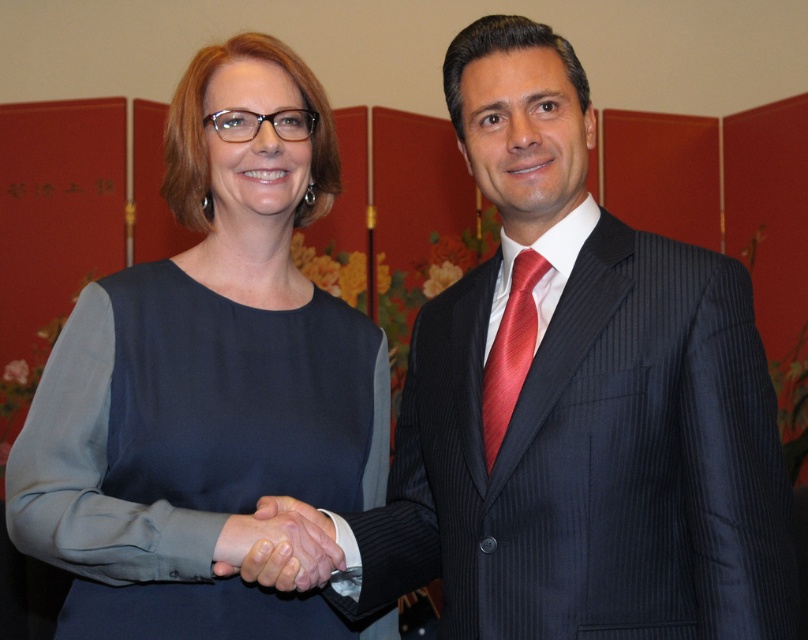
Is matte black dress at center shorter than shiny red tie at center?

In fact, matte black dress at center may be taller than shiny red tie at center.

Is point (89, 564) more distant than point (531, 339)?

No, it is in front of (531, 339).

Locate an element on the screen. This screenshot has height=640, width=808. matte black dress at center is located at coordinates (209, 384).

Is smooth skin handshake at center positioned at the back of shiny red tie at center?

No, smooth skin handshake at center is closer to the viewer.

The height and width of the screenshot is (640, 808). What do you see at coordinates (278, 545) in the screenshot?
I see `smooth skin handshake at center` at bounding box center [278, 545].

Which is in front, point (283, 557) or point (524, 308)?

Point (283, 557)

The image size is (808, 640). I want to click on smooth skin handshake at center, so tap(278, 545).

Is matte black dress at center wider than smooth skin handshake at center?

Yes, matte black dress at center is wider than smooth skin handshake at center.

Between matte black dress at center and smooth skin handshake at center, which one has more height?

matte black dress at center is taller.

Is point (331, 125) in front of point (320, 584)?

No, it is not.

The image size is (808, 640). I want to click on matte black dress at center, so click(209, 384).